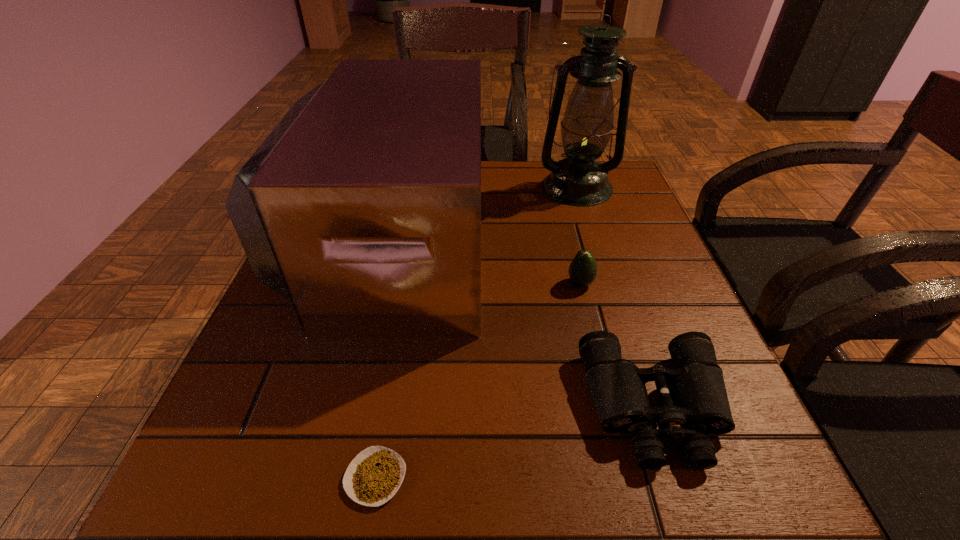
This screenshot has height=540, width=960. I want to click on oil lamp, so click(x=578, y=180).

You are a GUI agent. You are given a task and a screenshot of the screen. Output one action in this format:
    pyautogui.click(x=<x>, y=<y>)
    Task: Click on the microwave oven
    This screenshot has height=540, width=960.
    Given the screenshot: What is the action you would take?
    pyautogui.click(x=362, y=207)

I want to click on avocado, so click(x=583, y=269).

Identify the location of binoculars. The image size is (960, 540). (694, 402).

Locate an element on the screen. The height and width of the screenshot is (540, 960). legume is located at coordinates (374, 476).

This screenshot has height=540, width=960. I want to click on free spot located 0.180m on the front of the tallest object, so click(x=597, y=252).

Identify the location of free space located 0.150m on the front-facing side of the microwave oven. (547, 243).

Find the location of a particular element. Image resolution: width=960 pixels, height=540 pixels. vacant region located 0.170m on the left of the avocado is located at coordinates (483, 284).

Locate an element on the screen. This screenshot has height=540, width=960. free region located 0.380m on the right of the legume is located at coordinates (683, 477).

Find the location of a particular element. Image resolution: width=960 pixels, height=540 pixels. oil lamp located in the far edge section of the desktop is located at coordinates (x=578, y=180).